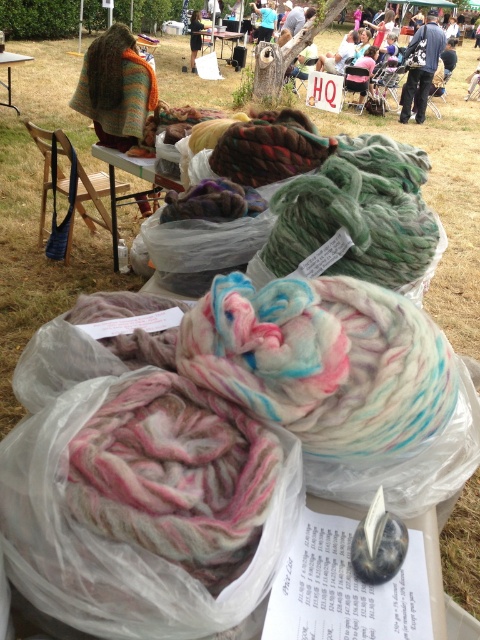
Is translucent plastic bags at center positioned in front of wooden table at center?

That is True.

Is translucent plastic bags at center shorter than wooden table at center?

Indeed, translucent plastic bags at center has a lesser height compared to wooden table at center.

Identify the location of translucent plastic bags at center. (135, 176).

At what (x,y) coordinates should I click in order to perform the action: click on translucent plastic bags at center. Please return your answer as a coordinate pair (x, y). Image resolution: width=480 pixels, height=640 pixels. Looking at the image, I should click on (135, 176).

Consider the image. Does wooden table at center have a greater height compared to white plastic table at upper left?

Yes, wooden table at center is taller than white plastic table at upper left.

Does wooden table at center have a greater width compared to white plastic table at upper left?

Indeed, wooden table at center has a greater width compared to white plastic table at upper left.

Describe the element at coordinates (223, 38) in the screenshot. I see `wooden table at center` at that location.

Identify the location of wooden table at center. (223, 38).

The height and width of the screenshot is (640, 480). Describe the element at coordinates (357, 212) in the screenshot. I see `multicolored wool at center` at that location.

Is multicolored wool at center taller than wooden table at center?

No, multicolored wool at center is not taller than wooden table at center.

At what (x,y) coordinates should I click in order to perform the action: click on multicolored wool at center. Please return your answer as a coordinate pair (x, y). Image resolution: width=480 pixels, height=640 pixels. Looking at the image, I should click on (357, 212).